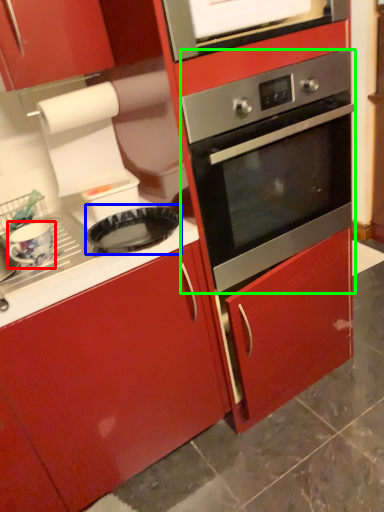
Question: Considering the real-world distances, which object is farthest from appliance (highlighted by a red box)? pizza pan (highlighted by a blue box) or oven (highlighted by a green box)?

Choices:
 (A) pizza pan
 (B) oven

Answer: (B)